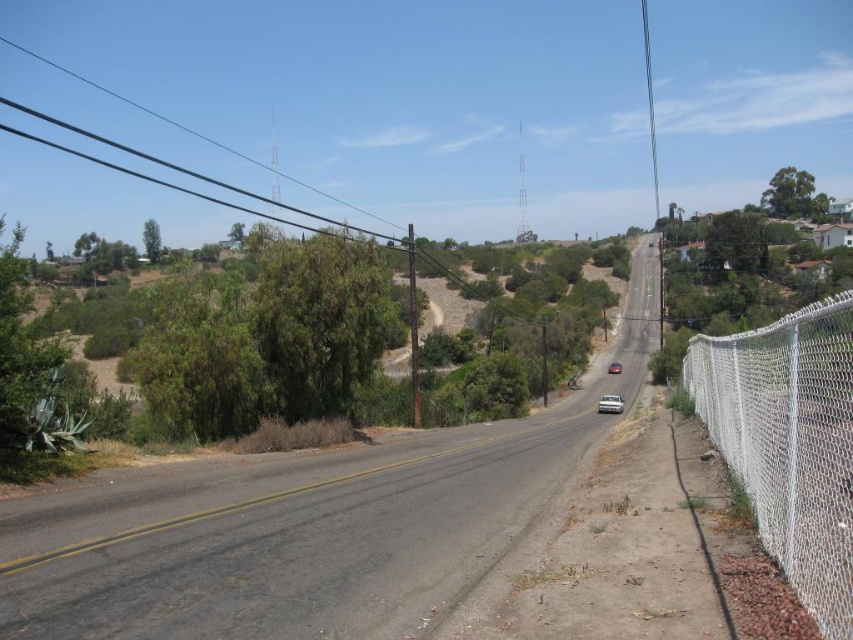
Question: Which object appears farthest from the camera in this image?

Choices:
 (A) asphalt road at center
 (B) green leafy tree at upper left

Answer: (B)

Question: Which point is farther to the camera?

Choices:
 (A) tap(850, 621)
 (B) tap(148, 228)

Answer: (B)

Question: Is the position of asphalt road at center less distant than that of green leafy tree at center?

Choices:
 (A) yes
 (B) no

Answer: (A)

Question: Does green leafy tree at center have a smaller size compared to green leafy tree at upper right?

Choices:
 (A) no
 (B) yes

Answer: (B)

Question: Which point appears farthest from the camera in this image?

Choices:
 (A) (793, 168)
 (B) (381, 285)

Answer: (A)

Question: Does white chain-link fence at right lie in front of green leafy tree at upper right?

Choices:
 (A) no
 (B) yes

Answer: (B)